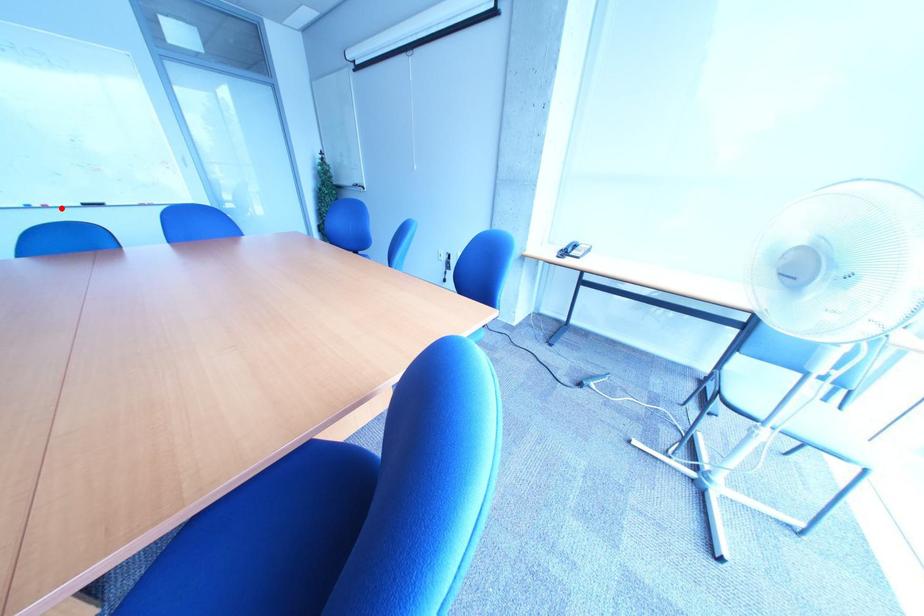
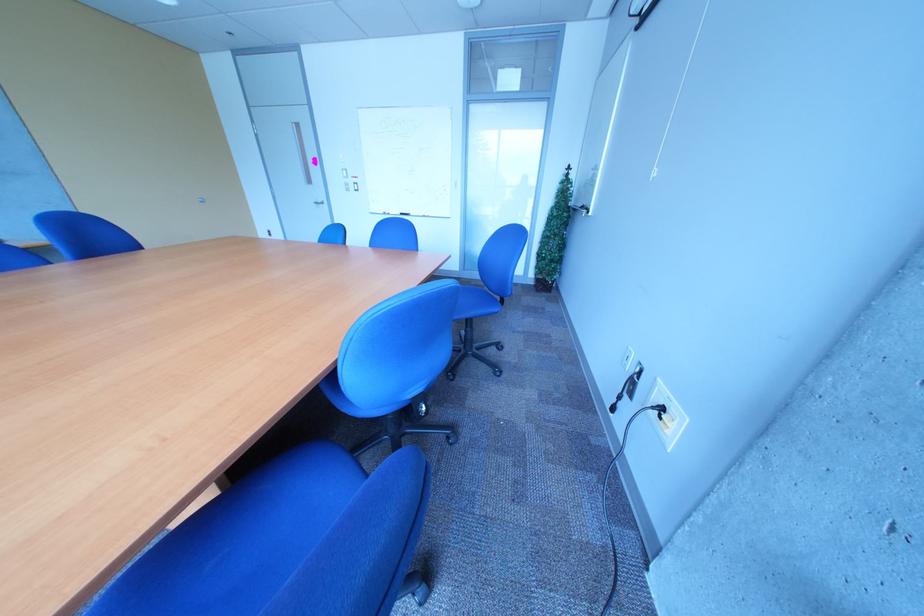
Find the pixel in the second image that matches the highlighted location in the first image.

(405, 216)